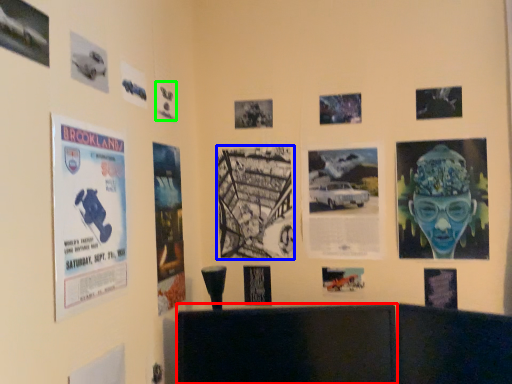
Question: Which object is positioned farthest from furniture (highlighted by a red box)? Select from poster (highlighted by a blue box) and poster (highlighted by a green box).

Choices:
 (A) poster
 (B) poster

Answer: (B)